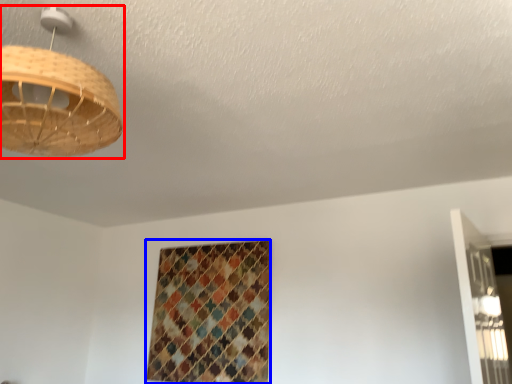
Question: Which object appears closest to the camera in this image, lamp (highlighted by a red box) or pattern (highlighted by a blue box)?

Choices:
 (A) lamp
 (B) pattern

Answer: (A)